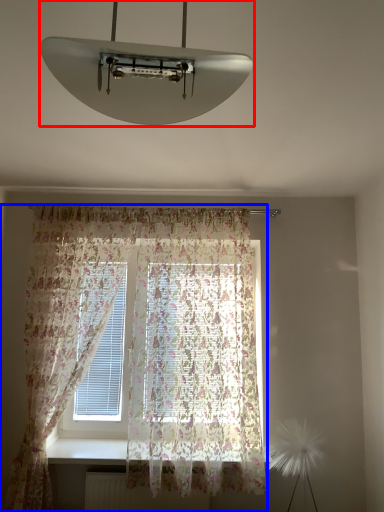
Question: Which point is closer to the camera, lamp (highlighted by a red box) or curtain (highlighted by a blue box)?

Choices:
 (A) lamp
 (B) curtain

Answer: (A)